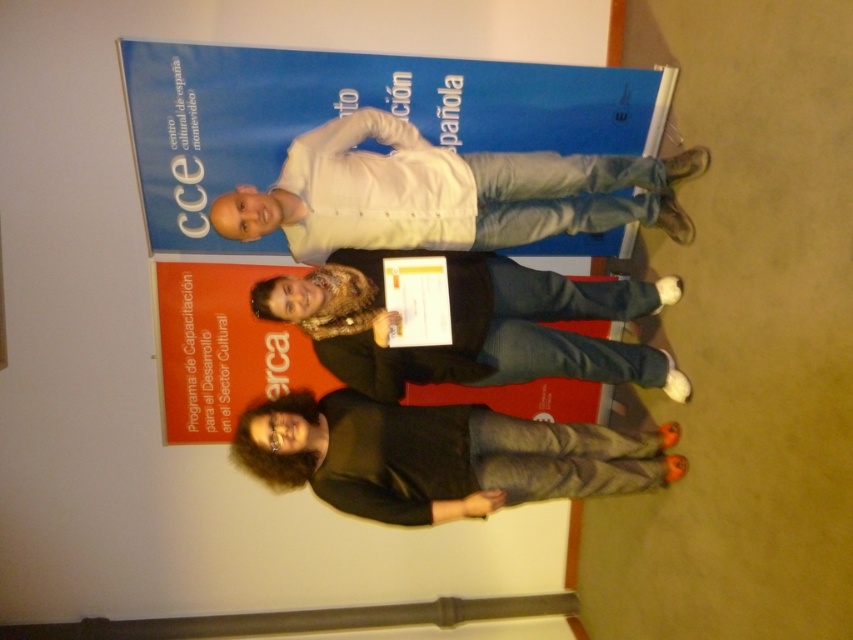
Question: Can you confirm if white matte shirt at center is positioned above matte black sweater at center?

Choices:
 (A) yes
 (B) no

Answer: (A)

Question: Does black matte shirt at lower center appear on the left side of matte black sweater at center?

Choices:
 (A) no
 (B) yes

Answer: (B)

Question: Which point is farther to the camera?

Choices:
 (A) (296, 440)
 (B) (360, 300)
 (C) (231, 211)

Answer: (B)

Question: Which object is farther from the camera taking this photo?

Choices:
 (A) matte black sweater at center
 (B) white matte shirt at center
 (C) black matte shirt at lower center

Answer: (C)

Question: Which point appears closest to the camera in this image?

Choices:
 (A) (407, 465)
 (B) (596, 310)

Answer: (A)

Question: Where is black matte shirt at lower center located in relation to matte black sweater at center in the image?

Choices:
 (A) above
 (B) below

Answer: (B)